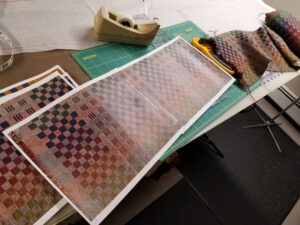
The height and width of the screenshot is (225, 300). I want to click on fabric pattern prints, so click(96, 146), click(209, 74), click(42, 93), click(40, 77), click(68, 75).